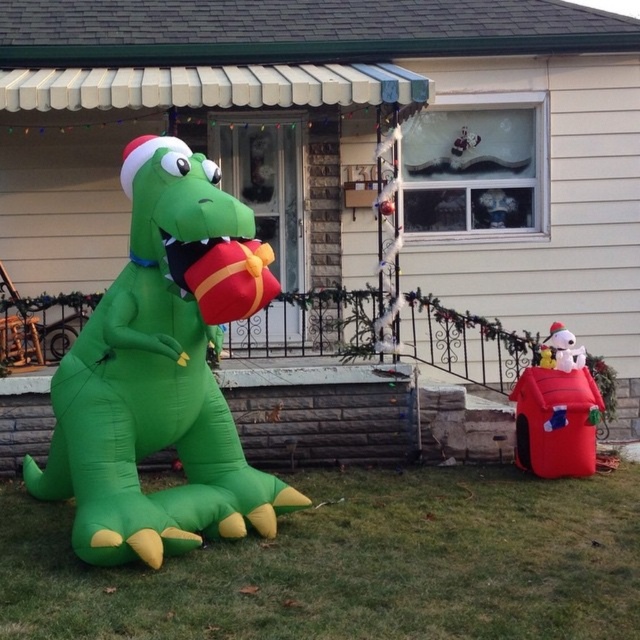
Which is behind, point (100, 332) or point (576, 362)?

Point (576, 362)

Who is higher up, green inflatable dinosaur at left or red plush doghouse at lower right?

green inflatable dinosaur at left

This screenshot has height=640, width=640. Identify the location of green inflatable dinosaur at left. tap(154, 384).

Does point (288, 563) come farther from viewer compared to point (252, 225)?

Yes, point (288, 563) is farther from viewer.

Between green inflatable dinosaur at lower left and green inflatable dinosaur at left, which one has more height?

With more height is green inflatable dinosaur at left.

The width and height of the screenshot is (640, 640). Describe the element at coordinates (355, 564) in the screenshot. I see `green inflatable dinosaur at lower left` at that location.

Find the location of a particular element. green inflatable dinosaur at lower left is located at coordinates (355, 564).

Can you confirm if green inflatable dinosaur at lower left is positioned below red plush doghouse at lower right?

Indeed, green inflatable dinosaur at lower left is positioned under red plush doghouse at lower right.

What do you see at coordinates (355, 564) in the screenshot? This screenshot has height=640, width=640. I see `green inflatable dinosaur at lower left` at bounding box center [355, 564].

The width and height of the screenshot is (640, 640). Find the location of `green inflatable dinosaur at lower left`. green inflatable dinosaur at lower left is located at coordinates (355, 564).

Image resolution: width=640 pixels, height=640 pixels. Identify the location of green inflatable dinosaur at lower left. (355, 564).